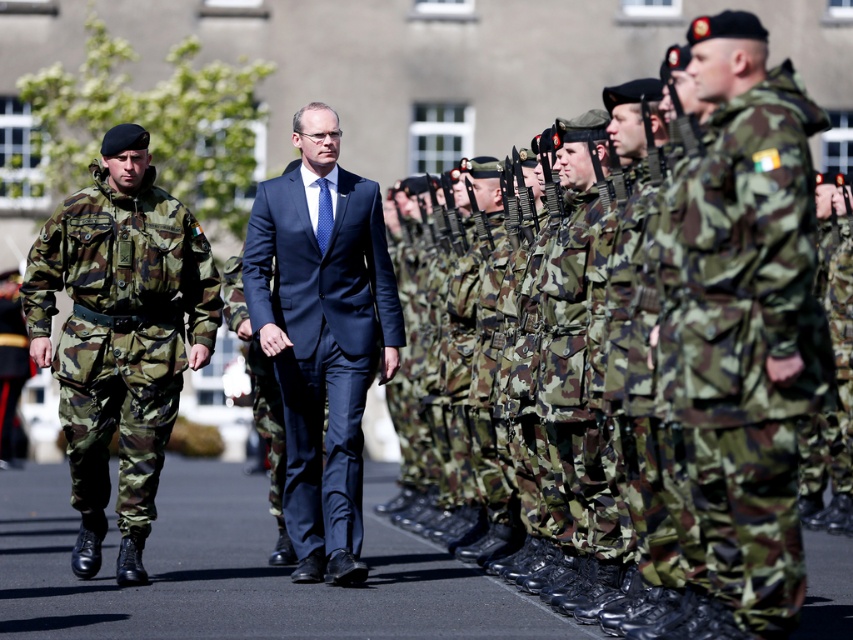
Which is below, camouflage fabric uniform at center or camouflage fabric uniform at left?

camouflage fabric uniform at left

Is camouflage fabric uniform at center behind camouflage fabric uniform at left?

That is False.

Which is behind, point (805, 385) or point (32, 308)?

Positioned behind is point (32, 308).

Where is `camouflage fabric uniform at center`? The width and height of the screenshot is (853, 640). camouflage fabric uniform at center is located at coordinates (747, 324).

Does camouflage fabric uniform at left appear under navy blue suit at center?

Indeed, camouflage fabric uniform at left is positioned under navy blue suit at center.

Between point (100, 529) and point (381, 284), which one is positioned in front?

Point (100, 529) is more forward.

At what (x,y) coordinates should I click in order to perform the action: click on camouflage fabric uniform at left. Please return your answer as a coordinate pair (x, y). The width and height of the screenshot is (853, 640). Looking at the image, I should click on (120, 336).

Is camouflage fabric uniform at center thinner than navy blue suit at center?

Yes.

Describe the element at coordinates (747, 324) in the screenshot. The image size is (853, 640). I see `camouflage fabric uniform at center` at that location.

Where is `camouflage fabric uniform at center`? camouflage fabric uniform at center is located at coordinates click(747, 324).